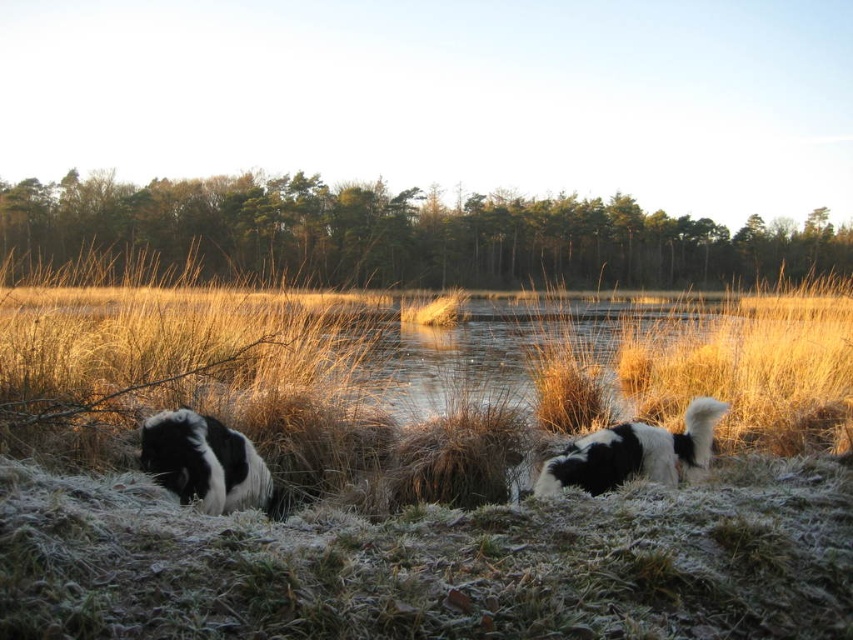
You are a photographer trying to capture both black and white fur dog at lower left and black and white fur dog at lower right in a single shot. Which dog will appear closer to the camera in the photo?

The black and white fur dog at lower left will appear closer to the camera because it is further to the viewer than the black and white fur dog at lower right, meaning it is positioned nearer in the scene.

You are a photographer aiming to capture a closeup of the frosted grass at center while also including the black and white fur dog at lower right in the frame. Based on their distance, what is the minimum focal length you should use to ensure both are in focus?

The frosted grass at center and black and white fur dog at lower right are 4.16 meters apart. To ensure both are in focus, the photographer should use a focal length that allows for a sufficient depth of field to cover this distance, typically requiring a narrower aperture or a lens with a focal length around 50mm or lower, depending on the camera sensor size.

You are a photographer trying to capture the frosted grass at center and the black and white fur dog at lower left in a single frame. Based on their sizes, which object would occupy more horizontal space in the photo?

The frosted grass at center would occupy more horizontal space in the photo since its width surpasses that of the black and white fur dog at lower left.